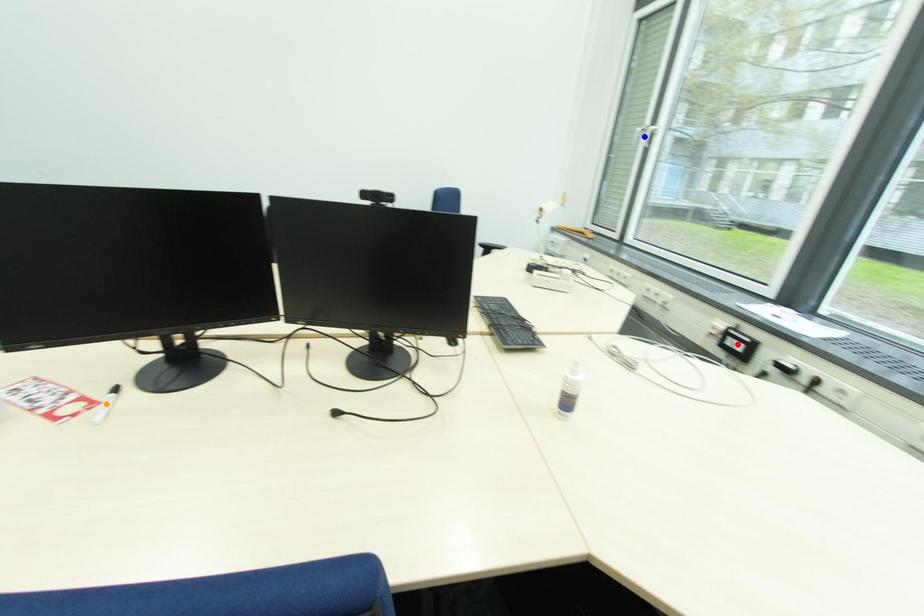
Order these from nearest to farthest:
blue point
orange point
red point

orange point → red point → blue point